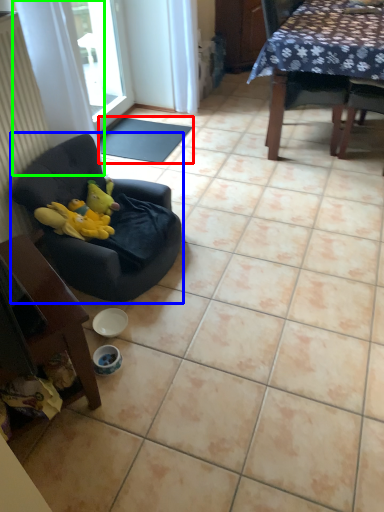
Question: Which is nearer to the mat (highlighted by a red box)? chair (highlighted by a blue box) or curtain (highlighted by a green box).

Choices:
 (A) chair
 (B) curtain

Answer: (B)